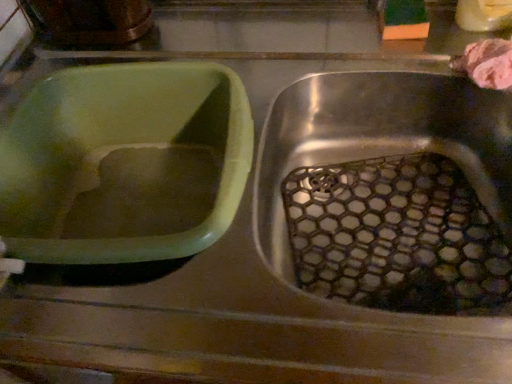
At what (x,y) coordinates should I click in order to perform the action: click on green plastic basin at left. Please return your answer as a coordinate pair (x, y). The image size is (512, 384). Looking at the image, I should click on (116, 148).

Describe the element at coordinates (116, 148) in the screenshot. Image resolution: width=512 pixels, height=384 pixels. I see `green plastic basin at left` at that location.

I want to click on pink fluffy sponge at upper right, so click(487, 63).

What is the approximate height of pink fluffy sponge at upper right?

pink fluffy sponge at upper right is 2.45 inches in height.

What do you see at coordinates (487, 63) in the screenshot?
I see `pink fluffy sponge at upper right` at bounding box center [487, 63].

The width and height of the screenshot is (512, 384). In order to click on green plastic basin at left in this screenshot , I will do `click(116, 148)`.

Can you confirm if green plastic basin at left is positioned to the left of pink fluffy sponge at upper right?

Yes.

Which object is further away from the camera, green plastic basin at left or pink fluffy sponge at upper right?

pink fluffy sponge at upper right is more distant.

Which point is more forward, (161,135) or (469,57)?

Point (469,57)

From the image's perspective, between green plastic basin at left and pink fluffy sponge at upper right, which one is located above?

pink fluffy sponge at upper right is shown above in the image.

From a real-world perspective, is green plastic basin at left under pink fluffy sponge at upper right?

Yes.

Is green plastic basin at left wider or thinner than pink fluffy sponge at upper right?

In the image, green plastic basin at left appears to be wider than pink fluffy sponge at upper right.

Does green plastic basin at left have a lesser height compared to pink fluffy sponge at upper right?

No, green plastic basin at left is not shorter than pink fluffy sponge at upper right.

Can you confirm if green plastic basin at left is smaller than pink fluffy sponge at upper right?

Actually, green plastic basin at left might be larger than pink fluffy sponge at upper right.

Is green plastic basin at left located outside pink fluffy sponge at upper right?

Yes, green plastic basin at left is not within pink fluffy sponge at upper right.

Is there a large distance between green plastic basin at left and pink fluffy sponge at upper right?

No.

Is green plastic basin at left oriented away from pink fluffy sponge at upper right?

No, green plastic basin at left's orientation is not away from pink fluffy sponge at upper right.

What's the angular difference between green plastic basin at left and pink fluffy sponge at upper right's facing directions?

The angle between the facing direction of green plastic basin at left and the facing direction of pink fluffy sponge at upper right is 1.18 degrees.

The height and width of the screenshot is (384, 512). I want to click on basin in front of the pink fluffy sponge at upper right, so click(116, 148).

Considering the positions of objects pink fluffy sponge at upper right and green plastic basin at left in the image provided, who is more to the right, pink fluffy sponge at upper right or green plastic basin at left?

pink fluffy sponge at upper right is more to the right.

Who is more distant, pink fluffy sponge at upper right or green plastic basin at left?

pink fluffy sponge at upper right is further away from the camera.

Is point (478, 70) behind point (102, 96)?

No.

Consider the image. From the image's perspective, is pink fluffy sponge at upper right located above green plastic basin at left?

Yes, from the image's perspective, pink fluffy sponge at upper right is over green plastic basin at left.

From a real-world perspective, which is physically below, pink fluffy sponge at upper right or green plastic basin at left?

From a 3D spatial view, green plastic basin at left is below.

Is pink fluffy sponge at upper right wider or thinner than green plastic basin at left?

pink fluffy sponge at upper right is thinner than green plastic basin at left.

Does pink fluffy sponge at upper right have a greater height compared to green plastic basin at left?

In fact, pink fluffy sponge at upper right may be shorter than green plastic basin at left.

Who is bigger, pink fluffy sponge at upper right or green plastic basin at left?

green plastic basin at left.

Do you think pink fluffy sponge at upper right is within green plastic basin at left, or outside of it?

pink fluffy sponge at upper right is outside green plastic basin at left.

Is pink fluffy sponge at upper right beside green plastic basin at left?

No, pink fluffy sponge at upper right is not beside green plastic basin at left.

From the picture: Could you tell me if pink fluffy sponge at upper right is facing green plastic basin at left?

No, pink fluffy sponge at upper right is not oriented towards green plastic basin at left.

The image size is (512, 384). What are the coordinates of `food above the green plastic basin at left (from a real-world perspective)` in the screenshot? It's located at (487, 63).

What are the coordinates of `food above the green plastic basin at left (from a real-world perspective)` in the screenshot? It's located at pos(487,63).

The height and width of the screenshot is (384, 512). Identify the location of food located above the green plastic basin at left (from the image's perspective). (487, 63).